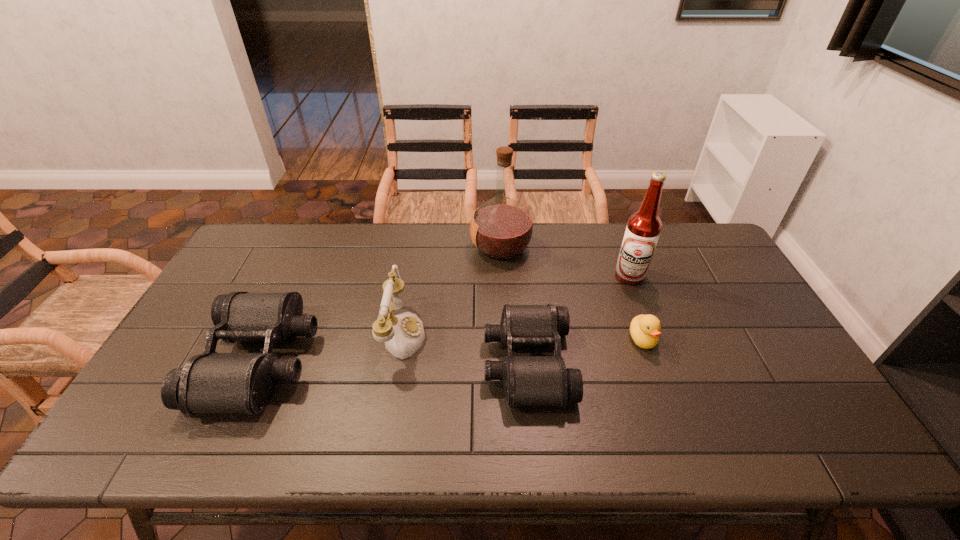
At what (x,y) coordinates should I click in order to perform the action: click on vacant point that satisfies the following two spatial constraints: 1. on the label side of the alcohol; 2. through the eyepieces of the third shortest object. Please return your answer as a coordinate pair (x, y). Image resolution: width=960 pixels, height=540 pixels. Looking at the image, I should click on (661, 360).

Where is `vacant region that satisfies the following two spatial constraints: 1. on the label side of the alcohol; 2. through the eyepieces of the shorter binoculars`? The image size is (960, 540). vacant region that satisfies the following two spatial constraints: 1. on the label side of the alcohol; 2. through the eyepieces of the shorter binoculars is located at coordinates (662, 362).